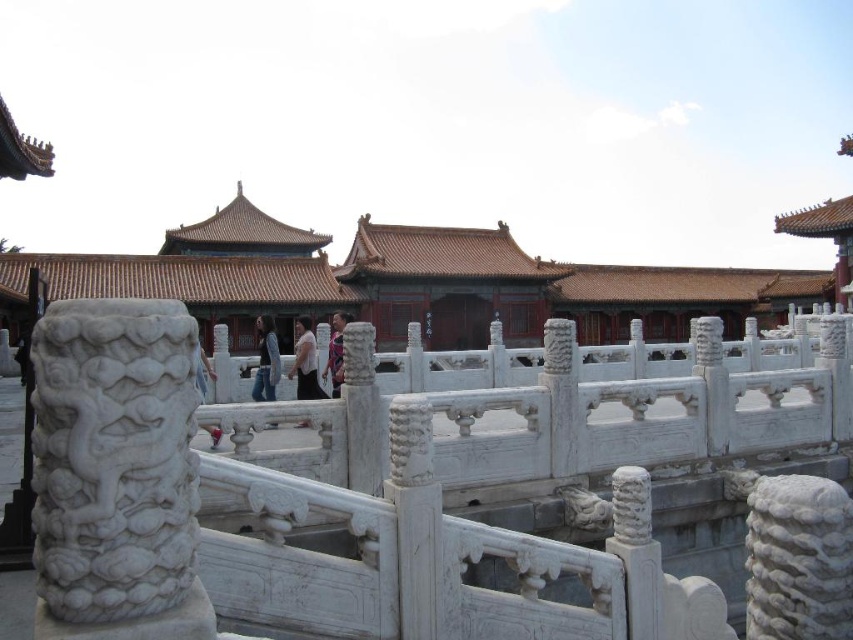
Can you confirm if white stone palace at center is positioned to the left of light brown fabric shirt at center?

Incorrect, white stone palace at center is not on the left side of light brown fabric shirt at center.

Consider the image. Is white stone palace at center taller than light brown fabric shirt at center?

Indeed, white stone palace at center has a greater height compared to light brown fabric shirt at center.

In the scene shown: Measure the distance between white stone palace at center and camera.

51.79 meters

Locate an element on the screen. This screenshot has height=640, width=853. white stone palace at center is located at coordinates (410, 284).

Consider the image. Who is taller, dark blue jeans at center or matte pink dress at center?

dark blue jeans at center

Which of these two, dark blue jeans at center or matte pink dress at center, stands shorter?

With less height is matte pink dress at center.

Which is behind, point (260, 324) or point (329, 372)?

The point (260, 324) is behind.

I want to click on dark blue jeans at center, so click(265, 362).

Does light brown fabric shirt at center appear on the left side of matte pink dress at center?

Indeed, light brown fabric shirt at center is positioned on the left side of matte pink dress at center.

Between light brown fabric shirt at center and matte pink dress at center, which one is positioned higher?

matte pink dress at center

Where is `light brown fabric shirt at center`? This screenshot has height=640, width=853. light brown fabric shirt at center is located at coordinates point(305,362).

This screenshot has height=640, width=853. Find the location of `light brown fabric shirt at center`. light brown fabric shirt at center is located at coordinates (305, 362).